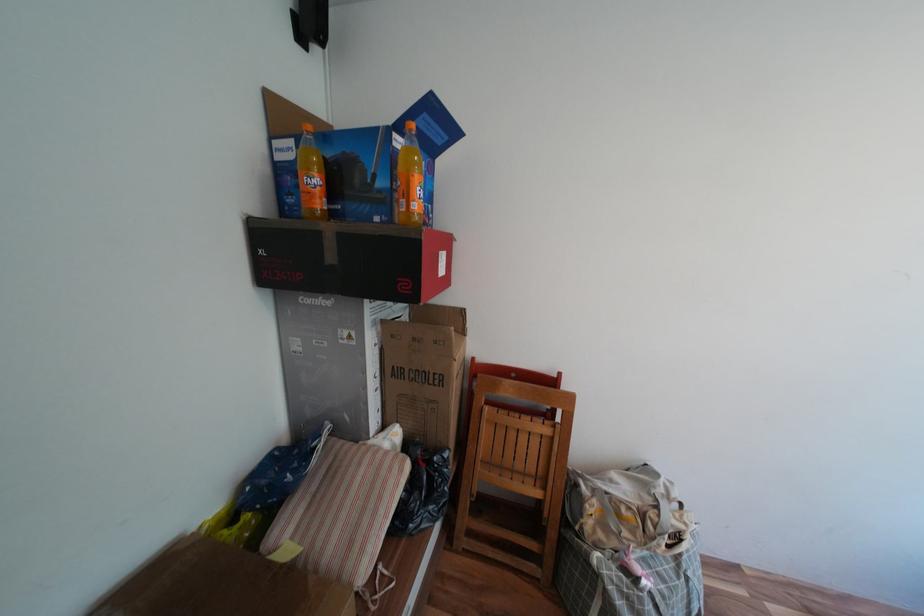
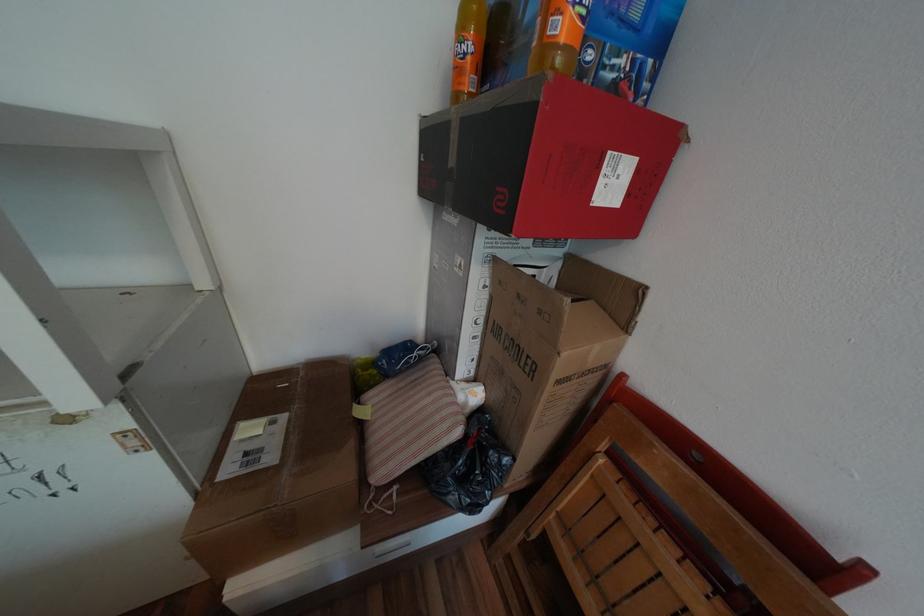
Where in the second image is the point corresponding to (424,206) from the first image?

(569, 26)